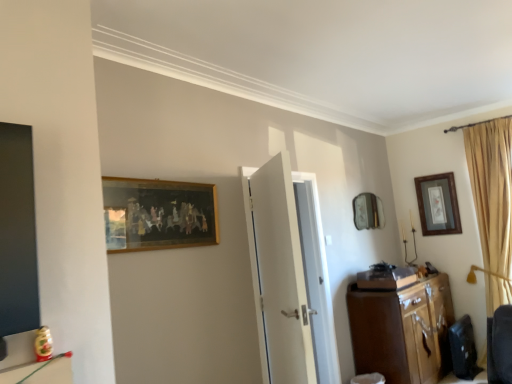
Question: From the image's perspective, is white glossy door at center positioned above or below wooden cabinet at right?

Choices:
 (A) above
 (B) below

Answer: (A)

Question: Is white glossy door at center bigger or smaller than wooden cabinet at right?

Choices:
 (A) small
 (B) big

Answer: (A)

Question: Which object is positioned farthest from the white glossy door at center?

Choices:
 (A) wooden cabinet at right
 (B) wooden framed artwork at upper left, placed as the 2th picture frame when sorted from back to front
 (C) wooden picture frame at upper right, marked as the second picture frame in a front-to-back arrangement

Answer: (C)

Question: Considering the real-world distances, which object is closest to the wooden framed artwork at upper left, which is the first picture frame from left to right?

Choices:
 (A) wooden cabinet at right
 (B) white glossy door at center
 (C) wooden picture frame at upper right, which is the second picture frame in left-to-right order

Answer: (B)